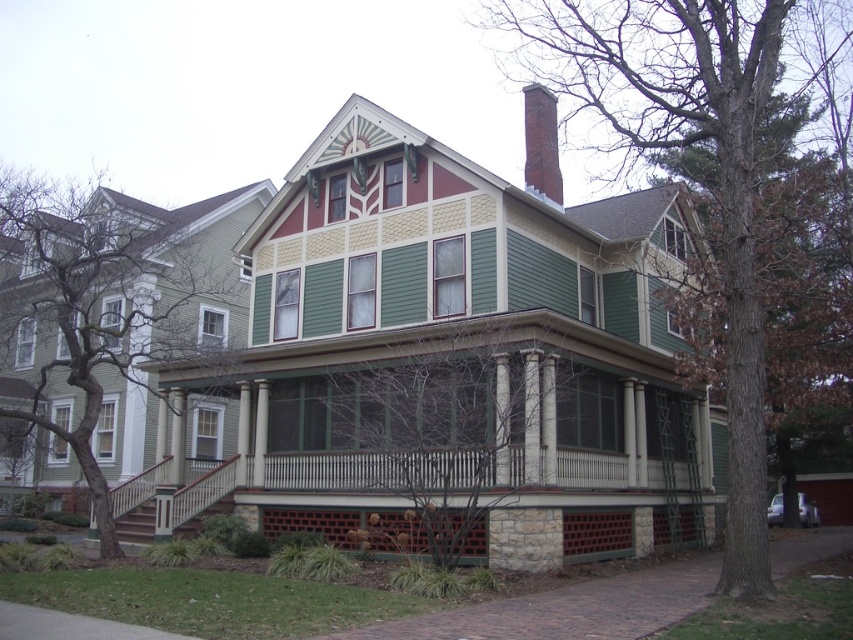
Question: Can you confirm if stone textured porch at lower center is bigger than smooth brick chimney at upper center?

Choices:
 (A) yes
 (B) no

Answer: (A)

Question: Which object appears closest to the camera in this image?

Choices:
 (A) smooth brick chimney at upper center
 (B) stone textured porch at lower center

Answer: (B)

Question: Which point is closer to the camera taking this photo?

Choices:
 (A) (489, 515)
 (B) (529, 84)

Answer: (A)

Question: Which point appears farthest from the camera in this image?

Choices:
 (A) (527, 179)
 (B) (381, 506)

Answer: (A)

Question: Does stone textured porch at lower center have a greater width compared to smooth brick chimney at upper center?

Choices:
 (A) no
 (B) yes

Answer: (B)

Question: Does stone textured porch at lower center appear on the right side of smooth brick chimney at upper center?

Choices:
 (A) yes
 (B) no

Answer: (B)